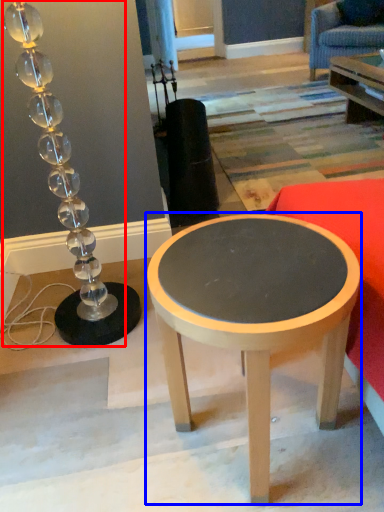
Question: Among these objects, which one is nearest to the camera, lamp (highlighted by a red box) or coffee table (highlighted by a blue box)?

Choices:
 (A) lamp
 (B) coffee table

Answer: (B)